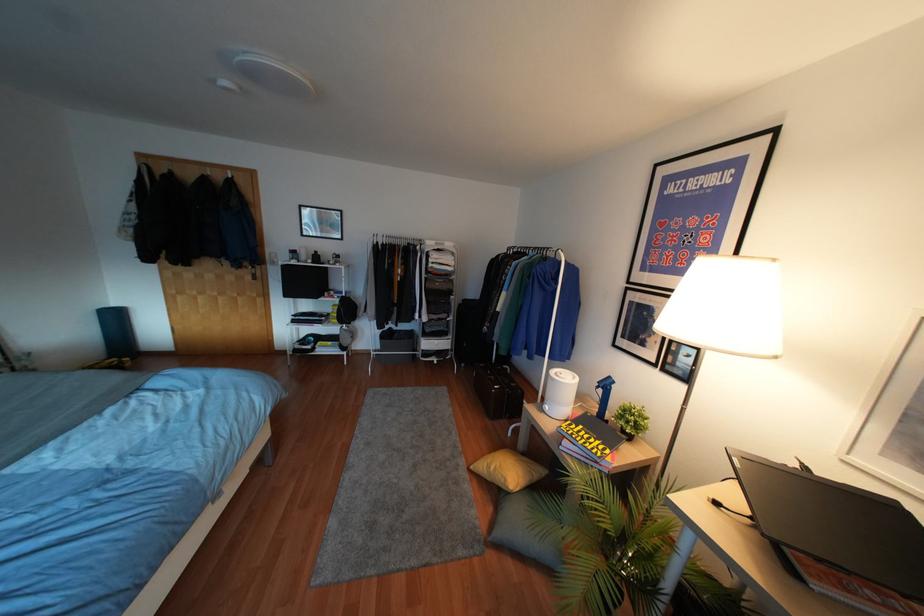
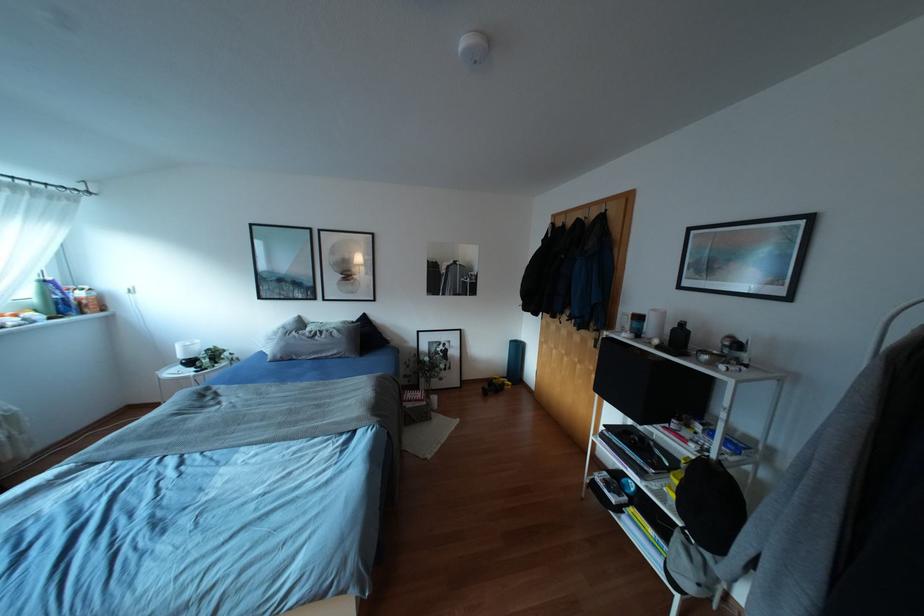
Where in the second image is the point corresponding to point (314, 252) from the first image?

(682, 323)